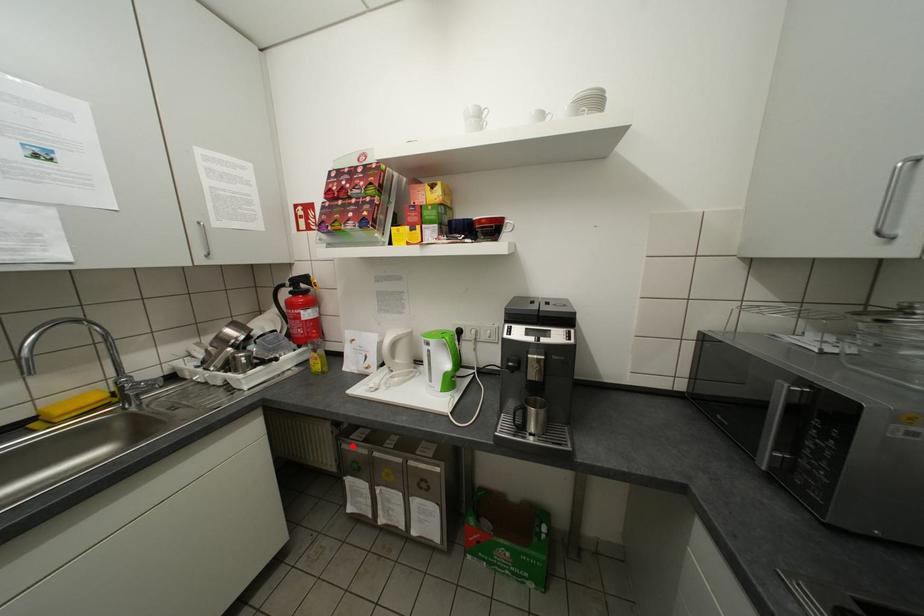
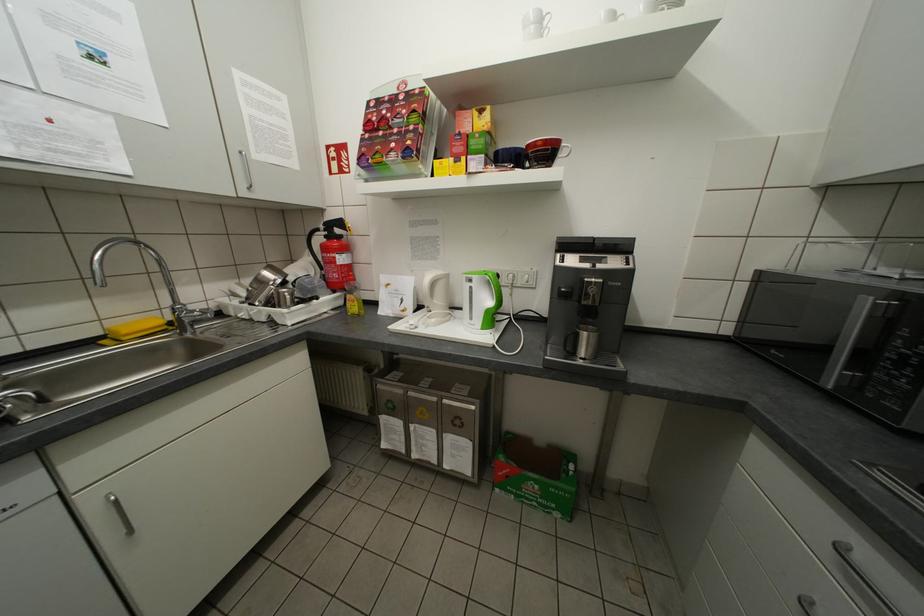
In the second image, find the point that corresponds to the highlighted location in the first image.

(387, 387)